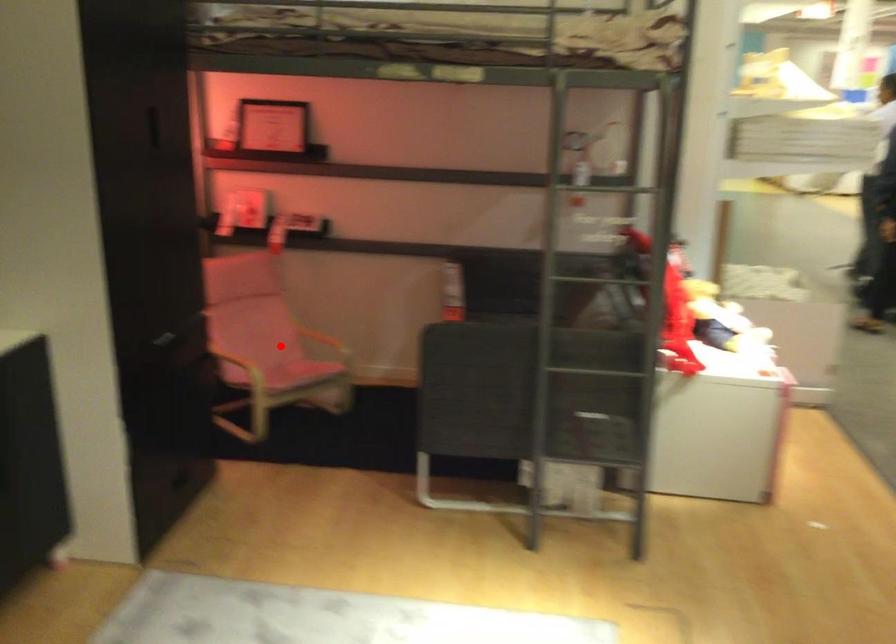
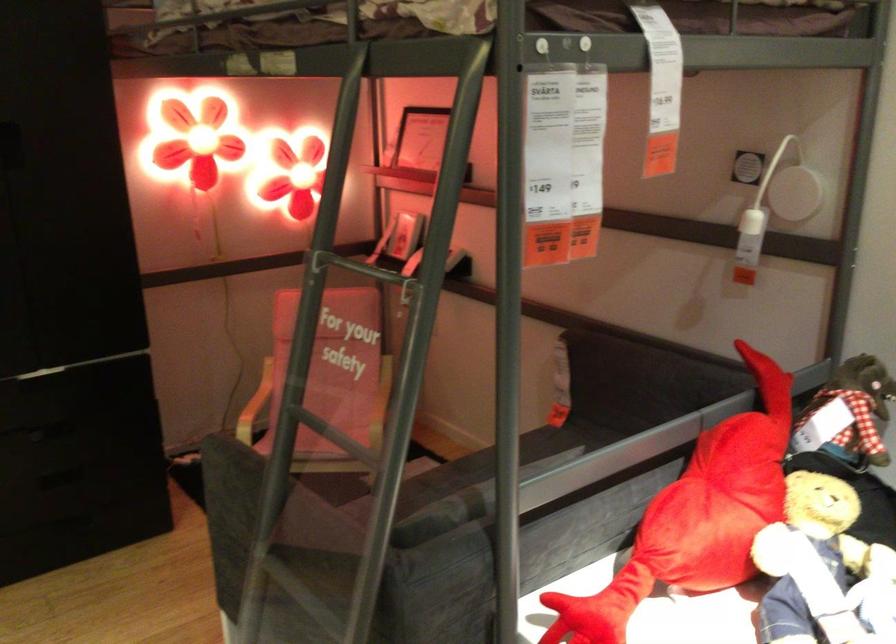
Question: I am providing you with two images of the same scene from different viewpoints. A red point is marked on the first image. At the location where the point appears in image 1, is it still visible in image 2?

Choices:
 (A) Yes
 (B) No

Answer: (A)